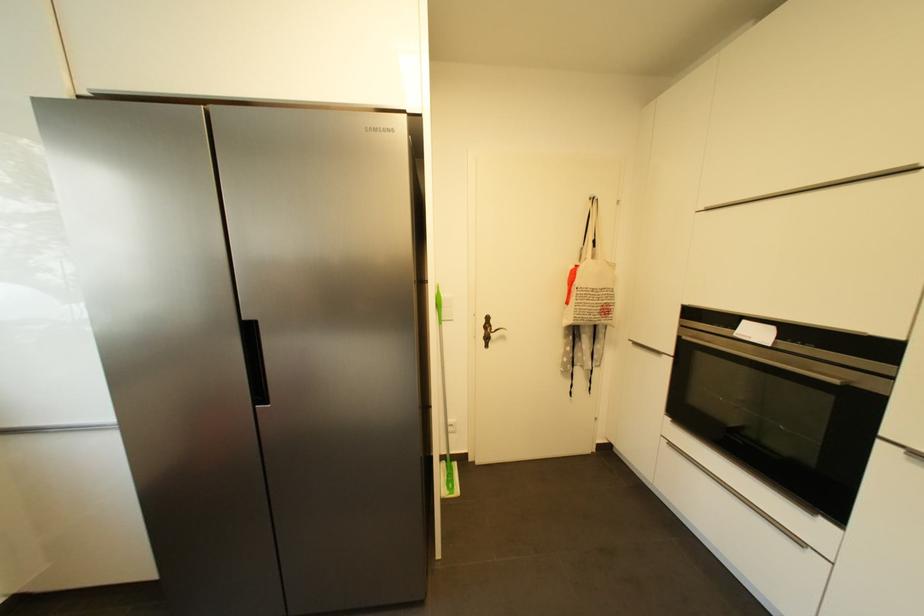
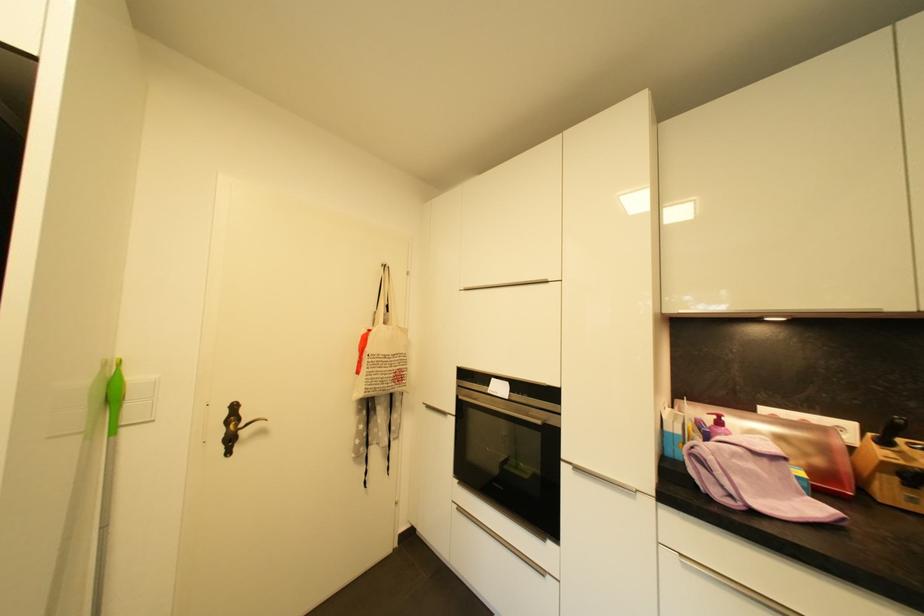
Where in the second image is the point corresponding to point (675, 447) from the first image?

(465, 511)